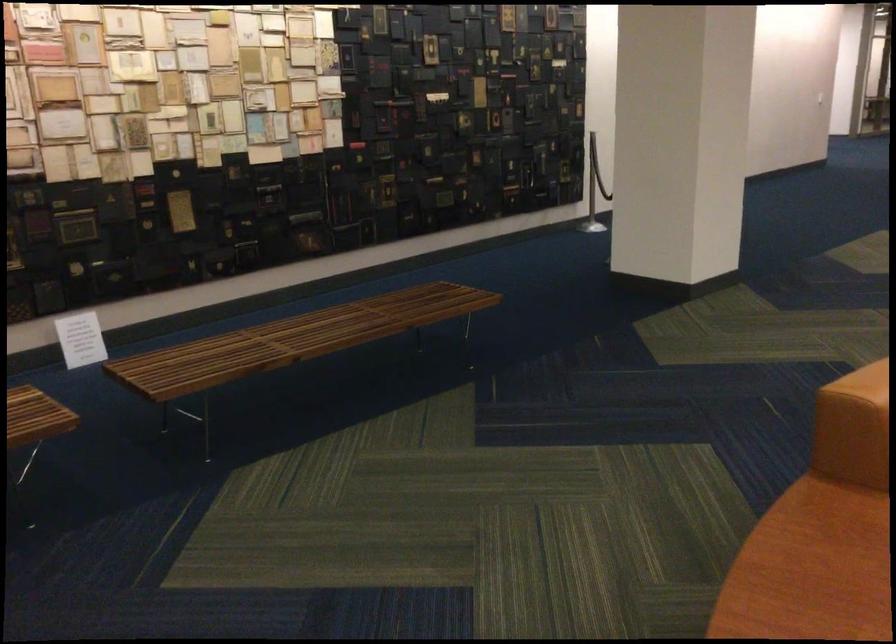
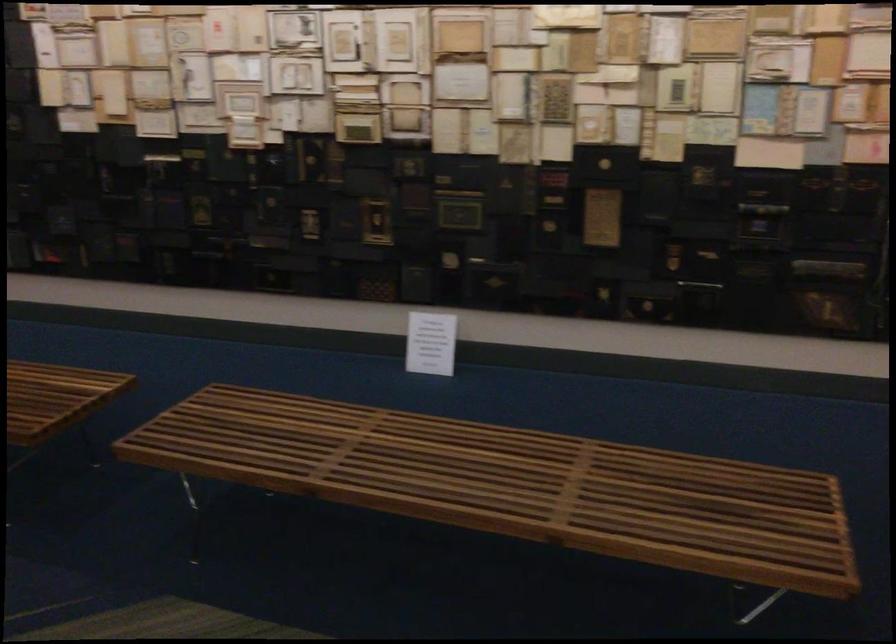
Locate, in the second image, the point that corresponds to point (85, 339) in the first image.

(431, 343)